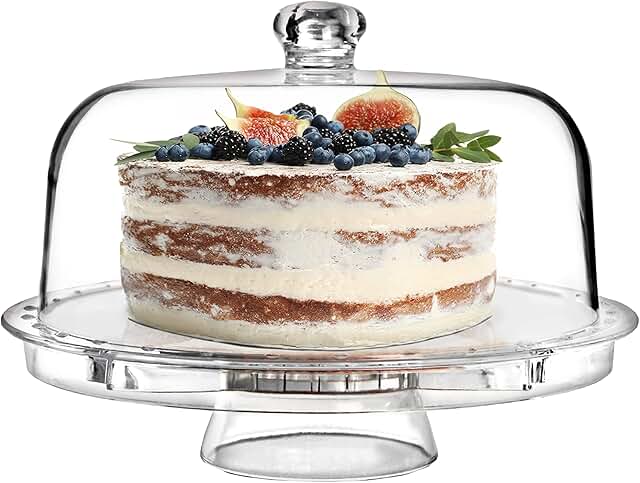
Where is `cake board stand`? Image resolution: width=640 pixels, height=483 pixels. cake board stand is located at coordinates (349, 447).